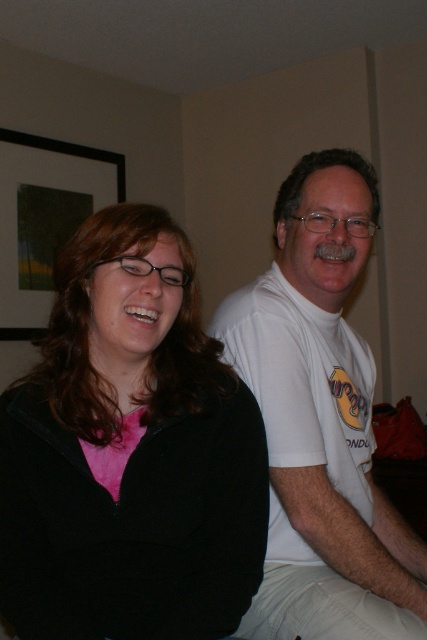
You are standing in the living room and want to place a small plant between the two points, point (155,417) and point (297,177). Which point should the plant be closer to in order to be closer to the viewer?

The plant should be closer to point (155,417) because it is closer to the viewer than point (297,177).

You are a photographer standing in front of the scene. You want to take a closeup shot of the black matte jacket at left without including any other objects in the frame. Considering your camera has a focal length of 50mm, can you estimate if the jacket will fill the frame adequately?

The black matte jacket at left is 34.36 inches away from the viewer. With a 50mm lens, this distance should allow the jacket to fill the frame appropriately without cropping out any parts, assuming standard framing techniques.

Based on the scene description, where is the black matte jacket at left positioned in terms of coordinates?

The black matte jacket at left is positioned at coordinates 0.711 on the x axis and 0.304 on the y axis.